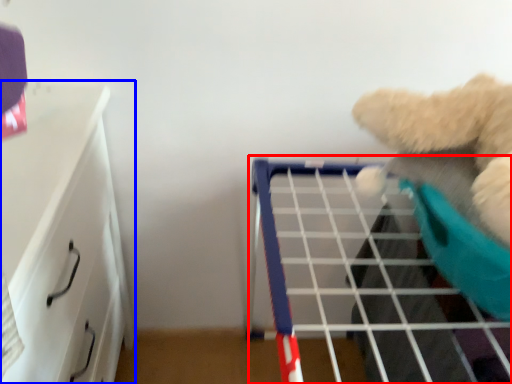
Question: Which point is closer to the camera, shelf (highlighted by a red box) or furniture (highlighted by a blue box)?

Choices:
 (A) shelf
 (B) furniture

Answer: (B)